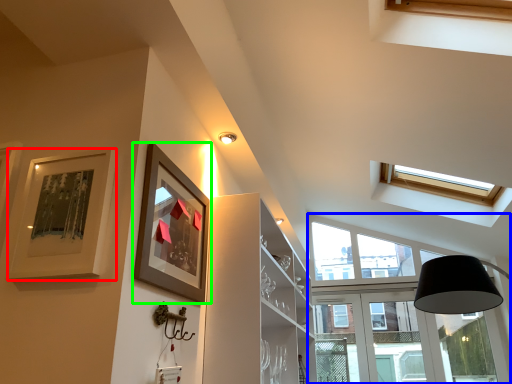
Question: Which object is positioned closest to picture frame (highlighted by a red box)? Select from window (highlighted by a blue box) and picture frame (highlighted by a green box).

Choices:
 (A) window
 (B) picture frame

Answer: (B)